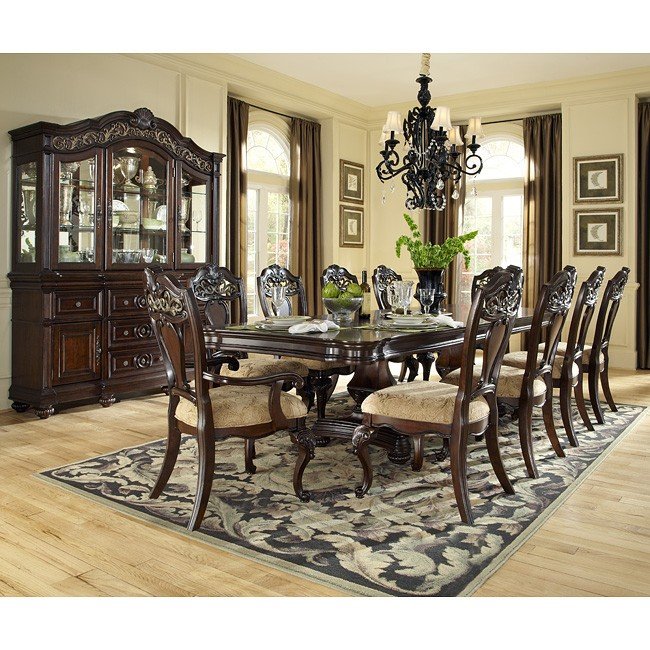
Locate an element on the screen. tops of chairs is located at coordinates (616, 291), (586, 299), (566, 304), (499, 304), (478, 280), (384, 278), (328, 280), (292, 281), (221, 286), (172, 302).